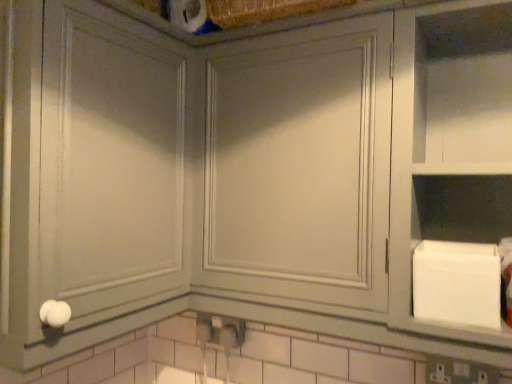
Question: From the image's perspective, is white matte cabinet at right positioned above or below matte gray cabinet at center, the 1th glass door from the left?

Choices:
 (A) below
 (B) above

Answer: (A)

Question: Is white matte cabinet at right wider or thinner than matte gray cabinet at center, the 2th glass door when ordered from right to left?

Choices:
 (A) thin
 (B) wide

Answer: (A)

Question: Estimate the real-world distances between objects in this image. Which object is farther from the matte gray cabinet at center, the first glass door when ordered from right to left?

Choices:
 (A) matte gray cabinet at center, the 1th glass door from the left
 (B) white matte cabinet at right

Answer: (A)

Question: Which of these objects is positioned closest to the matte gray cabinet at center, the first glass door when ordered from right to left?

Choices:
 (A) matte gray cabinet at center, the 2th glass door when ordered from right to left
 (B) white matte cabinet at right

Answer: (B)